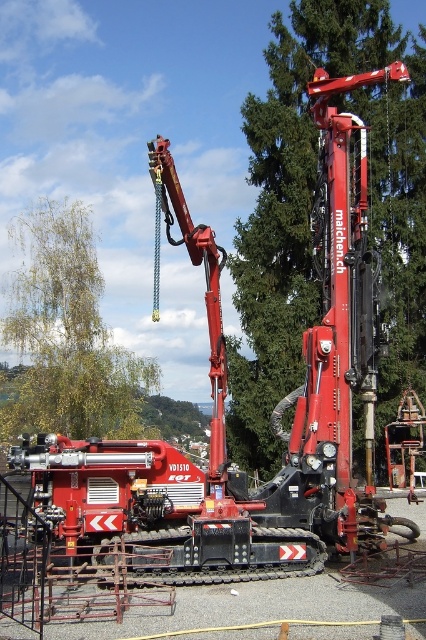
Based on the image, what are the coordinates of the green leafy tree at center?

The green leafy tree at center is located at coordinates (310, 208).

You are standing in front of the maichen.ch drilling rig and notice two green leafy trees in the background. Which tree, the green leafy tree at center or the green leafy tree at upper left, is positioned higher in the image?

The green leafy tree at center is located above the green leafy tree at upper left, so the green leafy tree at center is positioned higher in the image.

You are standing in front of the maichen.ch drilling rig and want to take a photo of the green leafy tree at center and the green leafy tree at upper left. Which tree will appear larger in the photo?

The green leafy tree at center will appear larger in the photo because it is closer to you than the green leafy tree at upper left, which is further away.